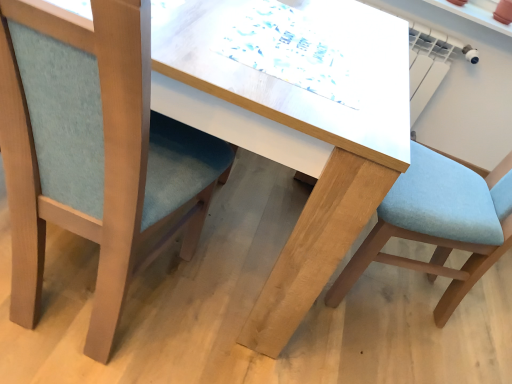
Question: Is light blue fabric chair at left, placed as the 2th chair when sorted from right to left, directly adjacent to light blue fabric chair at right, arranged as the 1th chair when viewed from the right?

Choices:
 (A) no
 (B) yes

Answer: (A)

Question: Considering the relative sizes of light blue fabric chair at left, placed as the 2th chair when sorted from right to left, and light blue fabric chair at right, arranged as the 1th chair when viewed from the right, in the image provided, is light blue fabric chair at left, placed as the 2th chair when sorted from right to left, smaller than light blue fabric chair at right, arranged as the 1th chair when viewed from the right,?

Choices:
 (A) yes
 (B) no

Answer: (A)

Question: From a real-world perspective, is light blue fabric chair at left, acting as the first chair starting from the left, located higher than light blue fabric chair at right, which is the second chair from left to right?

Choices:
 (A) no
 (B) yes

Answer: (A)

Question: Considering the relative sizes of light blue fabric chair at left, placed as the 2th chair when sorted from right to left, and light blue fabric chair at right, which is the second chair from left to right, in the image provided, is light blue fabric chair at left, placed as the 2th chair when sorted from right to left, taller than light blue fabric chair at right, which is the second chair from left to right,?

Choices:
 (A) no
 (B) yes

Answer: (A)

Question: Can you confirm if light blue fabric chair at left, acting as the first chair starting from the left, is wider than light blue fabric chair at right, which is the second chair from left to right?

Choices:
 (A) yes
 (B) no

Answer: (B)

Question: Is light blue fabric chair at left, placed as the 2th chair when sorted from right to left, to the right of light blue fabric chair at right, which is the second chair from left to right, from the viewer's perspective?

Choices:
 (A) no
 (B) yes

Answer: (A)

Question: Is light blue fabric chair at right, arranged as the 1th chair when viewed from the right, wider than light blue fabric chair at left, placed as the 2th chair when sorted from right to left?

Choices:
 (A) no
 (B) yes

Answer: (B)

Question: Is light blue fabric chair at right, which is the second chair from left to right, surrounding light blue fabric chair at left, placed as the 2th chair when sorted from right to left?

Choices:
 (A) no
 (B) yes

Answer: (A)

Question: From the image's perspective, is light blue fabric chair at right, arranged as the 1th chair when viewed from the right, below light blue fabric chair at left, acting as the first chair starting from the left?

Choices:
 (A) no
 (B) yes

Answer: (B)

Question: From the image's perspective, is light blue fabric chair at right, which is the second chair from left to right, above light blue fabric chair at left, placed as the 2th chair when sorted from right to left?

Choices:
 (A) yes
 (B) no

Answer: (B)

Question: Does light blue fabric chair at right, which is the second chair from left to right, have a greater height compared to light blue fabric chair at left, acting as the first chair starting from the left?

Choices:
 (A) yes
 (B) no

Answer: (A)

Question: Is light blue fabric chair at right, which is the second chair from left to right, next to light blue fabric chair at left, placed as the 2th chair when sorted from right to left, and touching it?

Choices:
 (A) no
 (B) yes

Answer: (A)

Question: Do you think light blue fabric chair at left, placed as the 2th chair when sorted from right to left, is within light blue fabric chair at right, arranged as the 1th chair when viewed from the right, or outside of it?

Choices:
 (A) outside
 (B) inside

Answer: (A)